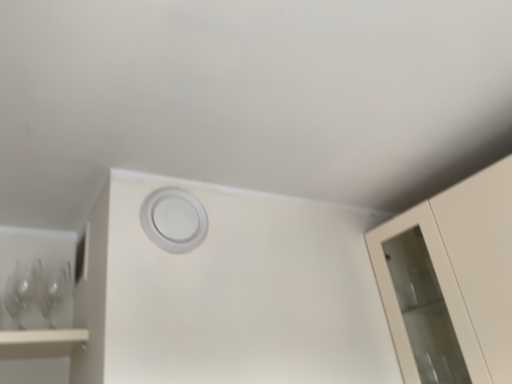
Question: Does point (4, 301) appear closer or farther from the camera than point (154, 196)?

Choices:
 (A) farther
 (B) closer

Answer: (A)

Question: Choose the correct answer: Is transparent glass wine glass at left, marked as the 2th wine glass in a right-to-left arrangement, inside white matte circle at center or outside it?

Choices:
 (A) outside
 (B) inside

Answer: (A)

Question: Estimate the real-world distances between objects in this image. Which object is farther from the clear glass wine glass at left, marked as the 1th wine glass in a right-to-left arrangement?

Choices:
 (A) transparent glass wine glass at left, marked as the 2th wine glass in a right-to-left arrangement
 (B) white matte circle at center

Answer: (B)

Question: Which of these objects is positioned farthest from the clear glass wine glass at left, marked as the 1th wine glass in a right-to-left arrangement?

Choices:
 (A) white matte circle at center
 (B) transparent glass wine glass at left, positioned as the first wine glass in left-to-right order

Answer: (A)